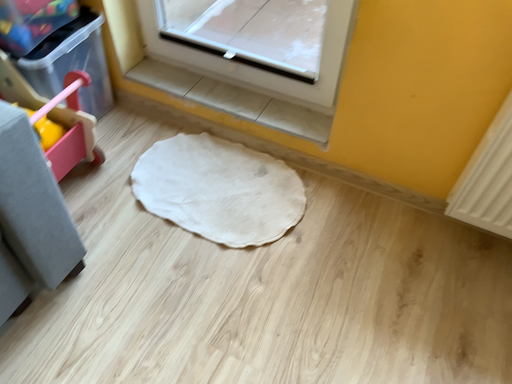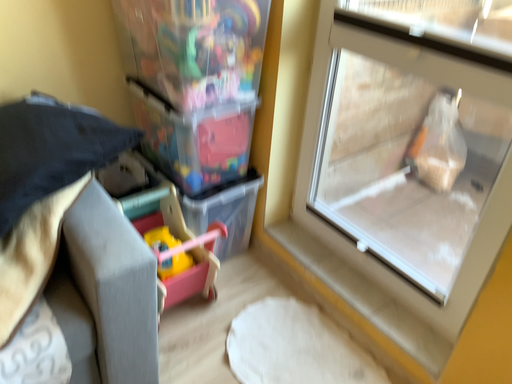
Question: How did the camera likely rotate when shooting the video?

Choices:
 (A) rotated right
 (B) rotated left

Answer: (B)